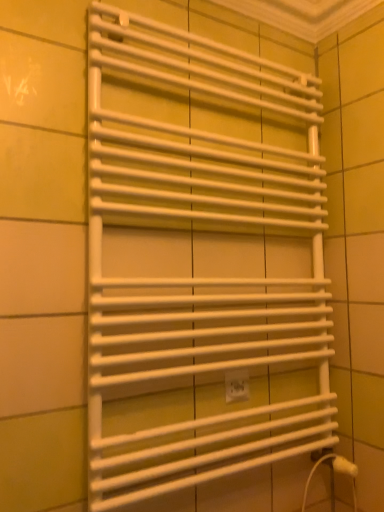
Question: Visually, is white matte towel rack at center positioned to the left or to the right of white plastic electric outlet at center?

Choices:
 (A) left
 (B) right

Answer: (A)

Question: From a real-world perspective, is white matte towel rack at center positioned above or below white plastic electric outlet at center?

Choices:
 (A) below
 (B) above

Answer: (B)

Question: Which is correct: white matte towel rack at center is inside white plastic electric outlet at center, or outside of it?

Choices:
 (A) inside
 (B) outside

Answer: (B)

Question: From the image's perspective, is white plastic electric outlet at center positioned above or below white matte towel rack at center?

Choices:
 (A) above
 (B) below

Answer: (B)

Question: Would you say white plastic electric outlet at center is to the left or to the right of white matte towel rack at center in the picture?

Choices:
 (A) right
 (B) left

Answer: (A)

Question: Considering their positions, is white plastic electric outlet at center located in front of or behind white matte towel rack at center?

Choices:
 (A) front
 (B) behind

Answer: (B)

Question: Is point (241, 371) closer or farther from the camera than point (279, 400)?

Choices:
 (A) farther
 (B) closer

Answer: (B)